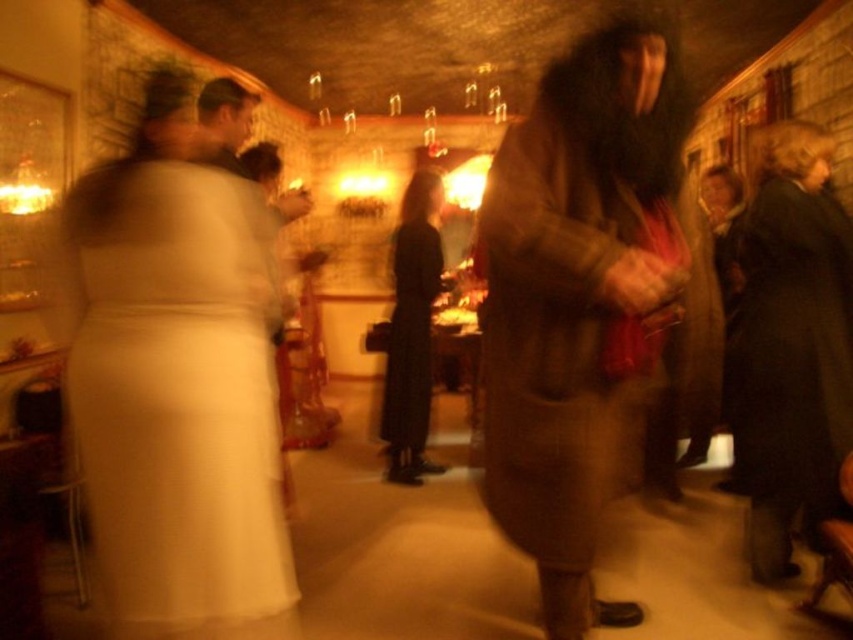
Question: Based on their relative distances, which object is farther from the white satin dress at left?

Choices:
 (A) black matte dress at center
 (B) dark brown coat at right
 (C) brown textured coat at center

Answer: (A)

Question: Is brown textured coat at center positioned at the back of white satin dress at left?

Choices:
 (A) no
 (B) yes

Answer: (B)

Question: Is dark brown coat at right to the left of black matte dress at center from the viewer's perspective?

Choices:
 (A) no
 (B) yes

Answer: (A)

Question: Does brown textured coat at center appear over black matte dress at center?

Choices:
 (A) no
 (B) yes

Answer: (A)

Question: Considering the real-world distances, which object is farthest from the brown textured coat at center?

Choices:
 (A) dark brown coat at right
 (B) black matte dress at center
 (C) white satin dress at left

Answer: (B)

Question: Which of the following is the closest to the observer?

Choices:
 (A) brown textured coat at center
 (B) dark brown coat at right
 (C) white satin dress at left
 (D) black matte dress at center

Answer: (C)